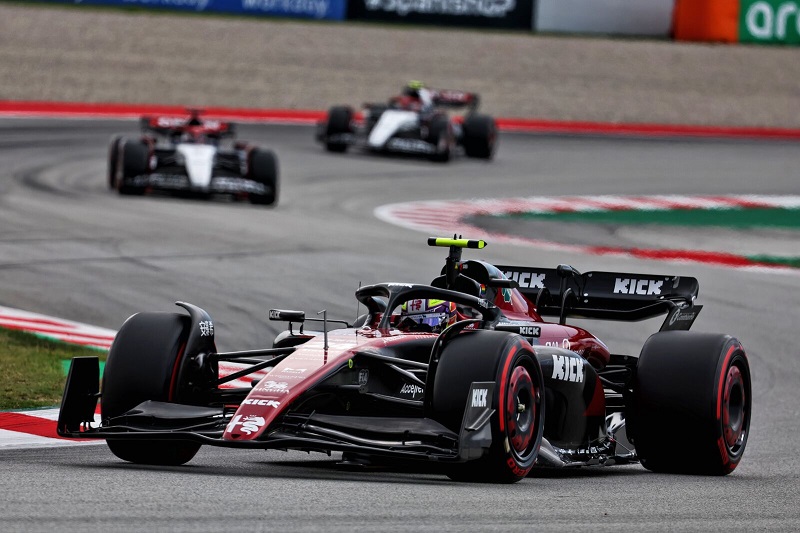
Where is `wall`? This screenshot has width=800, height=533. wall is located at coordinates (656, 72), (110, 70).